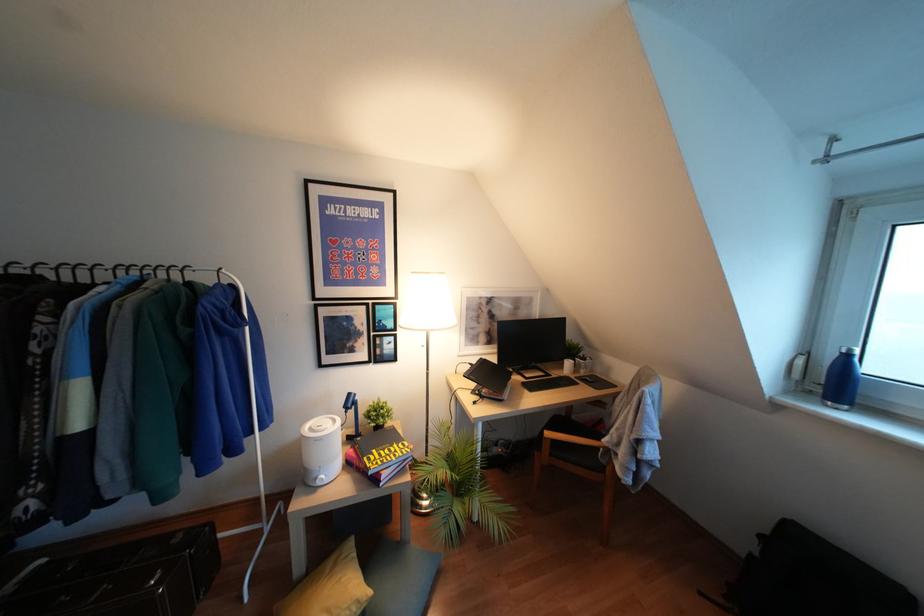
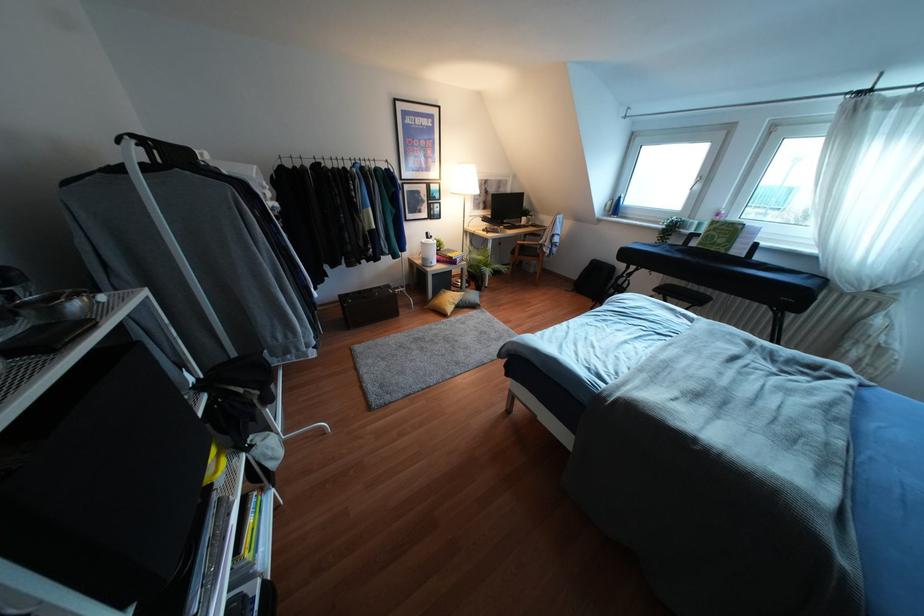
Find the pixel in the second image that matches pixel 330 561 in the first image.

(441, 292)